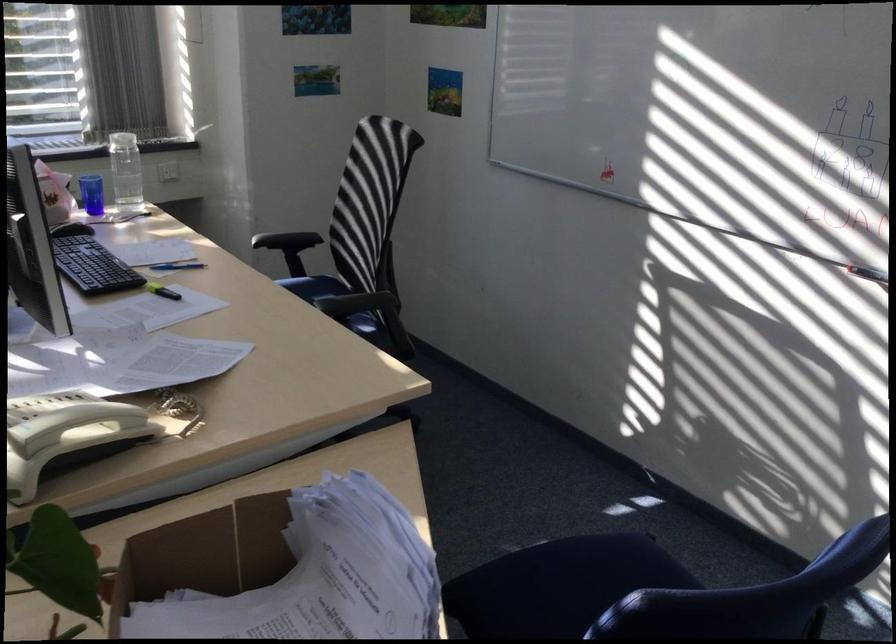
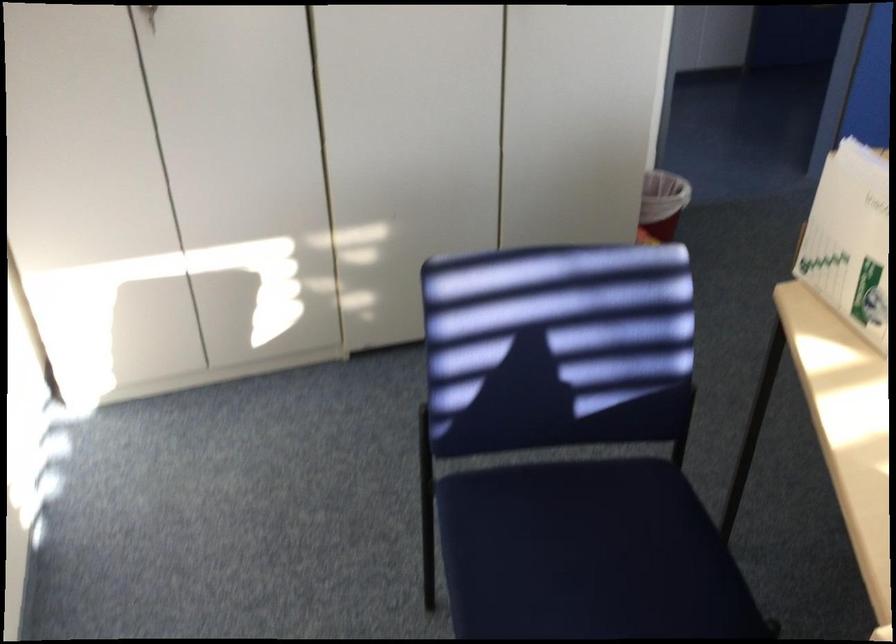
In the second image, find the point that corresponds to pixel 527 545 in the first image.

(588, 554)